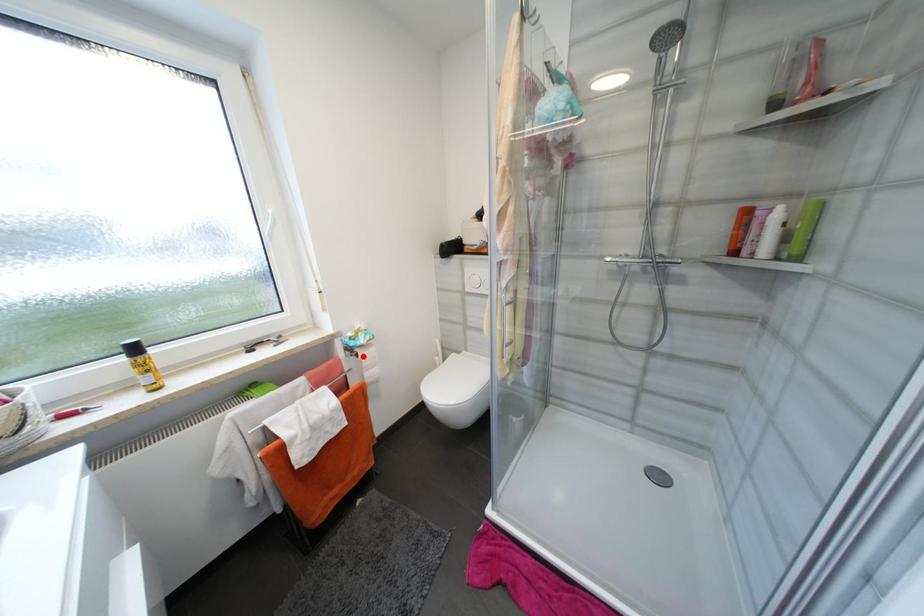
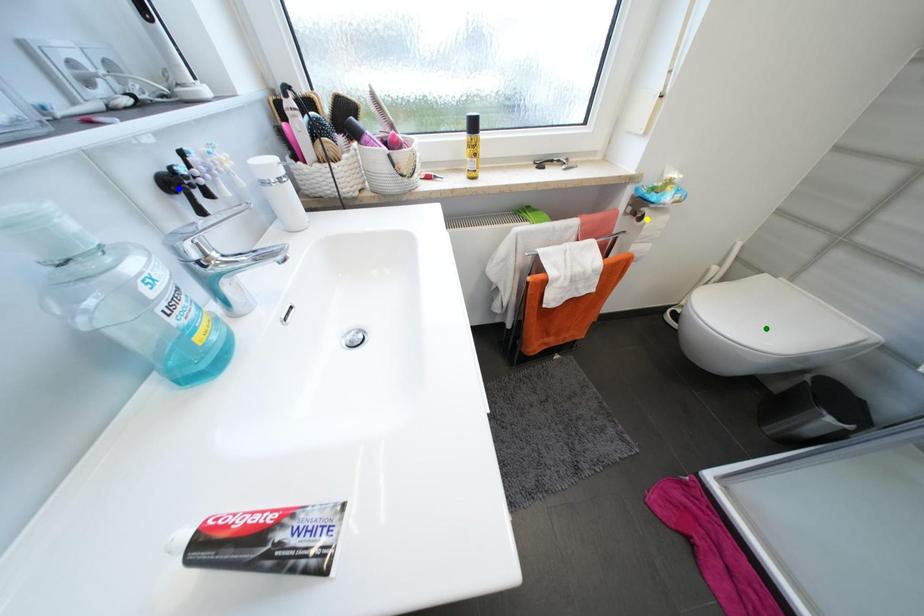
Question: I am providing you with two images of the same scene from different viewpoints. A red point is marked on the first image. You are given multiple points on the second image. In image 2, which mark is for the same physical point as the one in image 1?

Choices:
 (A) green point
 (B) yellow point
 (C) blue point

Answer: (B)